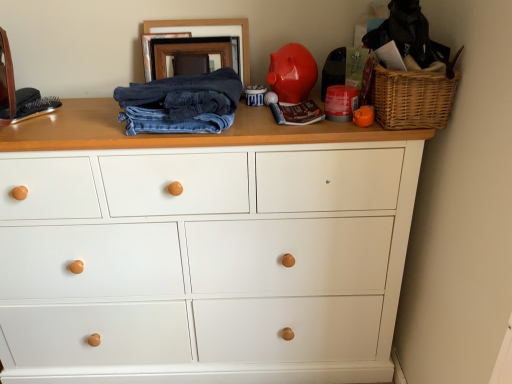
The height and width of the screenshot is (384, 512). What do you see at coordinates (181, 103) in the screenshot? I see `dark blue denim jeans at center` at bounding box center [181, 103].

You are a GUI agent. You are given a task and a screenshot of the screen. Output one action in this format:
    pyautogui.click(x=<x>, y=<y>)
    Task: Click on the glossy ceramic piggy bank at upper center
    
    Given the screenshot: What is the action you would take?
    point(292,73)

Image resolution: width=512 pixels, height=384 pixels. What do you see at coordinates (412, 98) in the screenshot?
I see `woven brown basket at upper right` at bounding box center [412, 98].

Locate an element on the screen. white matte chest of drawers at center is located at coordinates (202, 249).

Can you confirm if white matte chest of drawers at center is thinner than dark blue denim jeans at center?

In fact, white matte chest of drawers at center might be wider than dark blue denim jeans at center.

Is dark blue denim jeans at center a part of white matte chest of drawers at center?

No, white matte chest of drawers at center does not contain dark blue denim jeans at center.

Is white matte chest of drawers at center to the right of dark blue denim jeans at center from the viewer's perspective?

No.

From the image's perspective, is white matte chest of drawers at center located beneath dark blue denim jeans at center?

Yes, from the image's perspective, white matte chest of drawers at center is below dark blue denim jeans at center.

In the image, is dark blue denim jeans at center on the left side or the right side of woven brown basket at upper right?

dark blue denim jeans at center is to the left of woven brown basket at upper right.

Could you tell me if dark blue denim jeans at center is facing woven brown basket at upper right?

No, dark blue denim jeans at center is not facing towards woven brown basket at upper right.

Considering the relative sizes of dark blue denim jeans at center and woven brown basket at upper right in the image provided, is dark blue denim jeans at center shorter than woven brown basket at upper right?

Indeed, dark blue denim jeans at center has a lesser height compared to woven brown basket at upper right.

Considering the relative sizes of woven brown basket at upper right and white matte chest of drawers at center in the image provided, is woven brown basket at upper right shorter than white matte chest of drawers at center?

Yes, woven brown basket at upper right is shorter than white matte chest of drawers at center.

Does woven brown basket at upper right have a lesser width compared to white matte chest of drawers at center?

Yes.

Which is closer to the camera, (404, 100) or (105, 160)?

The point (404, 100) is in front.

From a real-world perspective, which object stands above the other?

glossy ceramic piggy bank at upper center is physically above.

Between glossy ceramic piggy bank at upper center and woven brown basket at upper right, which one appears on the right side from the viewer's perspective?

woven brown basket at upper right.

Does glossy ceramic piggy bank at upper center have a lesser height compared to woven brown basket at upper right?

No.

How many degrees apart are the facing directions of glossy ceramic piggy bank at upper center and woven brown basket at upper right?

The facing directions of glossy ceramic piggy bank at upper center and woven brown basket at upper right are 2.48 degrees apart.

Considering the relative positions of woven brown basket at upper right and wooden picture frame at upper center in the image provided, is woven brown basket at upper right to the left of wooden picture frame at upper center from the viewer's perspective?

No, woven brown basket at upper right is not to the left of wooden picture frame at upper center.

Find the location of a particular element. Image resolution: width=512 pixels, height=384 pixels. picture frame that appears behind the woven brown basket at upper right is located at coordinates (209, 26).

Between woven brown basket at upper right and wooden picture frame at upper center, which one has less height?

Standing shorter between the two is woven brown basket at upper right.

Considering the sizes of objects woven brown basket at upper right and wooden picture frame at upper center in the image provided, who is wider, woven brown basket at upper right or wooden picture frame at upper center?

woven brown basket at upper right is wider.

Is dark blue denim jeans at center in contact with glossy ceramic piggy bank at upper center?

No, dark blue denim jeans at center is not next to glossy ceramic piggy bank at upper center.

Which is in front, point (142, 109) or point (308, 84)?

The point (142, 109) is in front.

Which object is thinner, dark blue denim jeans at center or glossy ceramic piggy bank at upper center?

Thinner between the two is glossy ceramic piggy bank at upper center.

Can you confirm if dark blue denim jeans at center is positioned to the right of glossy ceramic piggy bank at upper center?

No.

Is wooden picture frame at upper center facing towards woven brown basket at upper right?

No, wooden picture frame at upper center is not turned towards woven brown basket at upper right.

The height and width of the screenshot is (384, 512). I want to click on picture frame that appears above the woven brown basket at upper right (from a real-world perspective), so click(x=209, y=26).

Based on the photo, can you confirm if wooden picture frame at upper center is smaller than woven brown basket at upper right?

Indeed, wooden picture frame at upper center has a smaller size compared to woven brown basket at upper right.

I want to click on clothing above the white matte chest of drawers at center (from a real-world perspective), so click(x=181, y=103).

Where is `clothing behind the woven brown basket at upper right`? This screenshot has width=512, height=384. clothing behind the woven brown basket at upper right is located at coordinates (181, 103).

Consider the image. When comparing their distances from woven brown basket at upper right, does glossy ceramic piggy bank at upper center or dark blue denim jeans at center seem further?

The object further to woven brown basket at upper right is dark blue denim jeans at center.

Based on their spatial positions, is white matte chest of drawers at center or woven brown basket at upper right closer to glossy ceramic piggy bank at upper center?

woven brown basket at upper right is positioned closer to the anchor glossy ceramic piggy bank at upper center.

Which object lies further to the anchor point woven brown basket at upper right, white matte chest of drawers at center or wooden picture frame at upper center?

Among the two, white matte chest of drawers at center is located further to woven brown basket at upper right.

Based on their spatial positions, is dark blue denim jeans at center or wooden picture frame at upper center closer to glossy ceramic piggy bank at upper center?

wooden picture frame at upper center lies closer to glossy ceramic piggy bank at upper center than the other object.

Based on the photo, based on their spatial positions, is white matte chest of drawers at center or woven brown basket at upper right further from wooden picture frame at upper center?

white matte chest of drawers at center lies further to wooden picture frame at upper center than the other object.

Estimate the real-world distances between objects in this image. Which object is closer to glossy ceramic piggy bank at upper center, wooden picture frame at upper center or dark blue denim jeans at center?

wooden picture frame at upper center is positioned closer to the anchor glossy ceramic piggy bank at upper center.

From the image, which object appears to be farther from wooden picture frame at upper center, white matte chest of drawers at center or dark blue denim jeans at center?

Among the two, white matte chest of drawers at center is located further to wooden picture frame at upper center.

When comparing their distances from woven brown basket at upper right, does wooden picture frame at upper center or glossy ceramic piggy bank at upper center seem closer?

The object closer to woven brown basket at upper right is glossy ceramic piggy bank at upper center.

Identify the location of clothing between wooden picture frame at upper center and glossy ceramic piggy bank at upper center. The image size is (512, 384). (181, 103).

The image size is (512, 384). What are the coordinates of `toy between dark blue denim jeans at center and woven brown basket at upper right from left to right` in the screenshot? It's located at (292, 73).

Identify the location of clothing between wooden picture frame at upper center and woven brown basket at upper right. This screenshot has height=384, width=512. (181, 103).

Where is `toy between white matte chest of drawers at center and woven brown basket at upper right`? Image resolution: width=512 pixels, height=384 pixels. toy between white matte chest of drawers at center and woven brown basket at upper right is located at coordinates (292, 73).